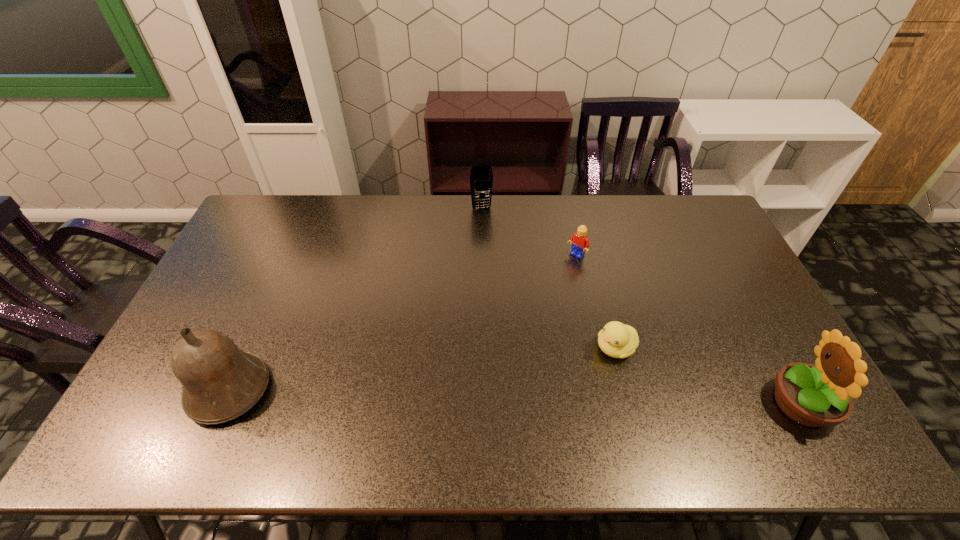
At what (x,y) coordinates should I click in order to perform the action: click on free spot on the desktop that is between the leftmost object and the sunflower and is positioned on the screen of the third tallest object. Please return your answer as a coordinate pair (x, y). Looking at the image, I should click on (525, 397).

At what (x,y) coordinates should I click in order to perform the action: click on vacant space on the desktop that is between the bell and the sunflower and is positioned at the beak of the duckling. Please return your answer as a coordinate pair (x, y). The image size is (960, 540). Looking at the image, I should click on (533, 397).

I want to click on vacant space on the desktop that is between the bell and the rightmost object and is positioned on the front-facing side of the second farthest object, so click(435, 395).